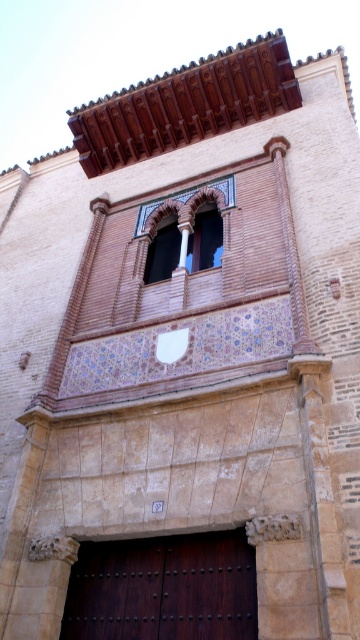
How far apart are dark brown wood at center and terracotta brick window at center?

The distance of dark brown wood at center from terracotta brick window at center is 35.47 feet.

The width and height of the screenshot is (360, 640). Describe the element at coordinates (164, 588) in the screenshot. I see `dark brown wood at center` at that location.

The height and width of the screenshot is (640, 360). I want to click on dark brown wood at center, so [x=164, y=588].